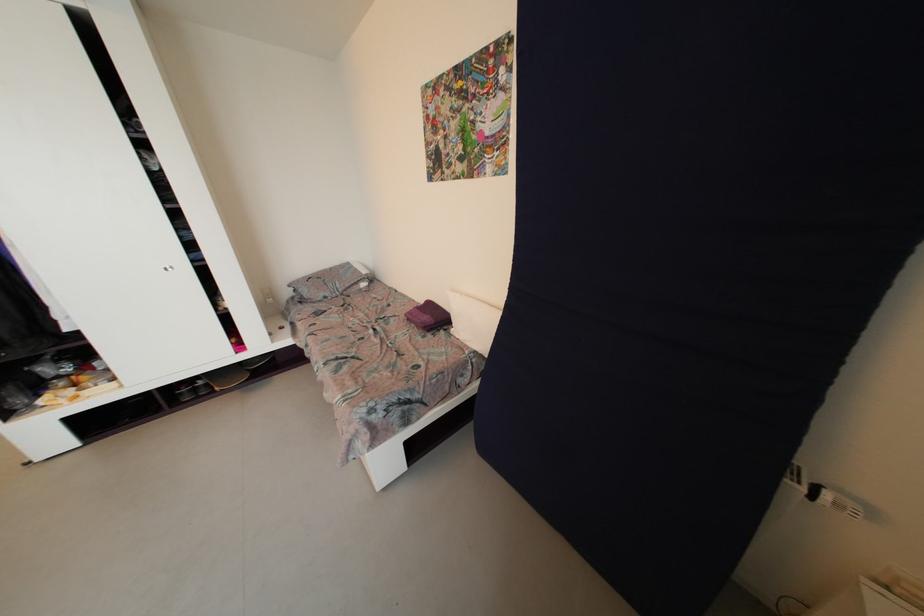
The height and width of the screenshot is (616, 924). Describe the element at coordinates (225, 377) in the screenshot. I see `the skateboard deck` at that location.